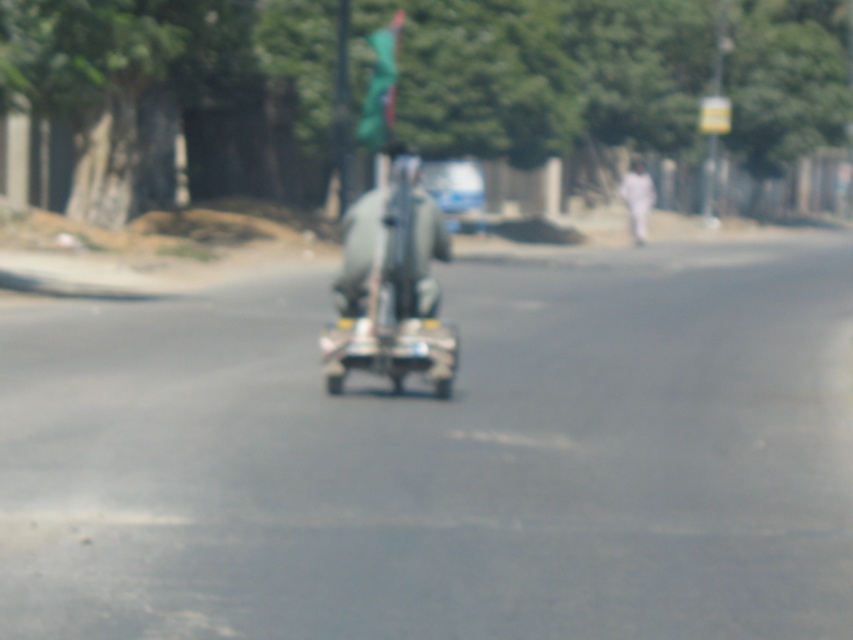
Looking at this image, you are a pedestrian standing on the sidewalk and you see a metallic gray figure at center and a metallic silver car at center. If you want to cross the road safely, which object should you wait for before proceeding?

The metallic gray figure at center and metallic silver car at center are 2.09 meters apart from each other. Since the metallic gray figure at center is closer to the metallic silver car at center, you should wait for the metallic silver car at center to pass first before crossing the road safely.

You are a delivery person using a motorized scooter for your job. You need to know if you can safely stop before reaching the point at coordinates point (345,348). Your scooter can brake to a stop within 15 meters from your current position. Can you stop in time?

The distance between point (345,348) and the camera is 16.50 meters. Since the scooter can brake within 15 meters, you cannot stop in time before reaching the point at coordinates point (345,348).